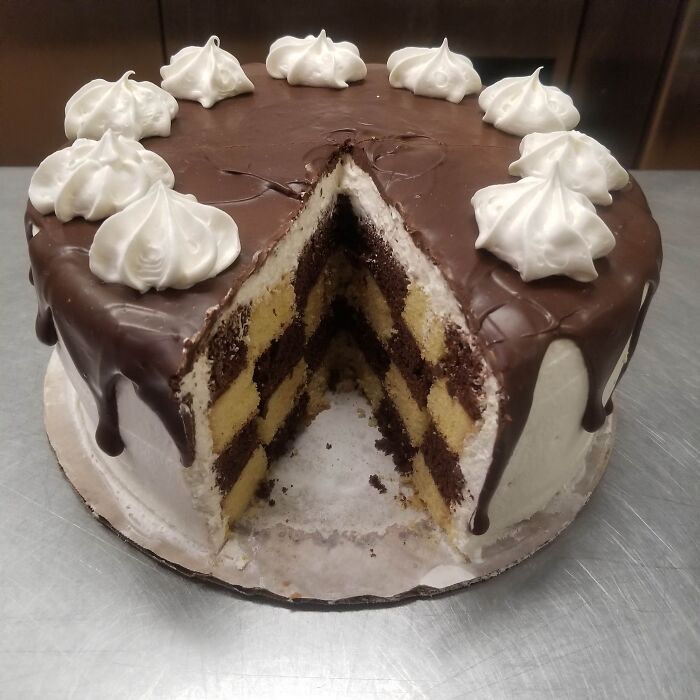
The height and width of the screenshot is (700, 700). Identify the location of scratches on metal table. (622, 563).